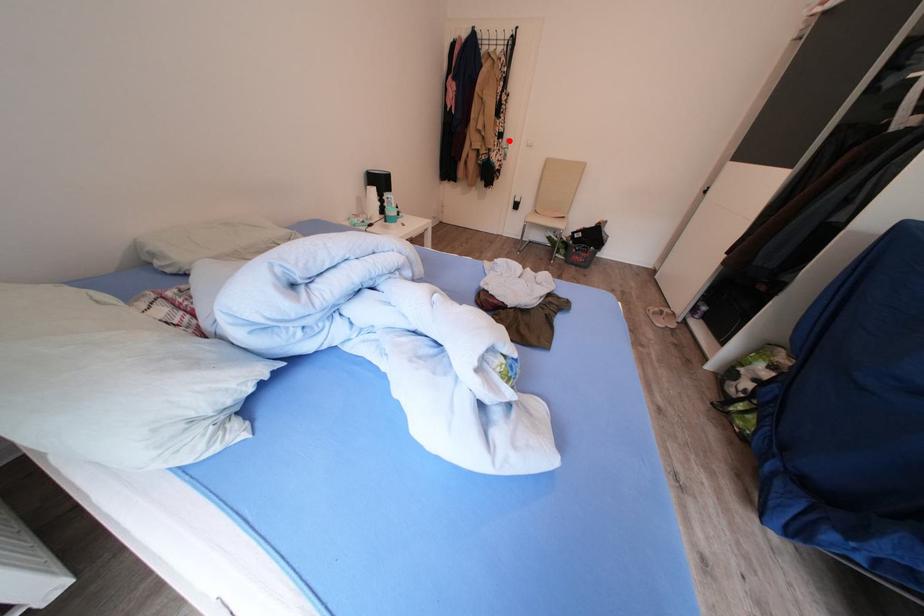
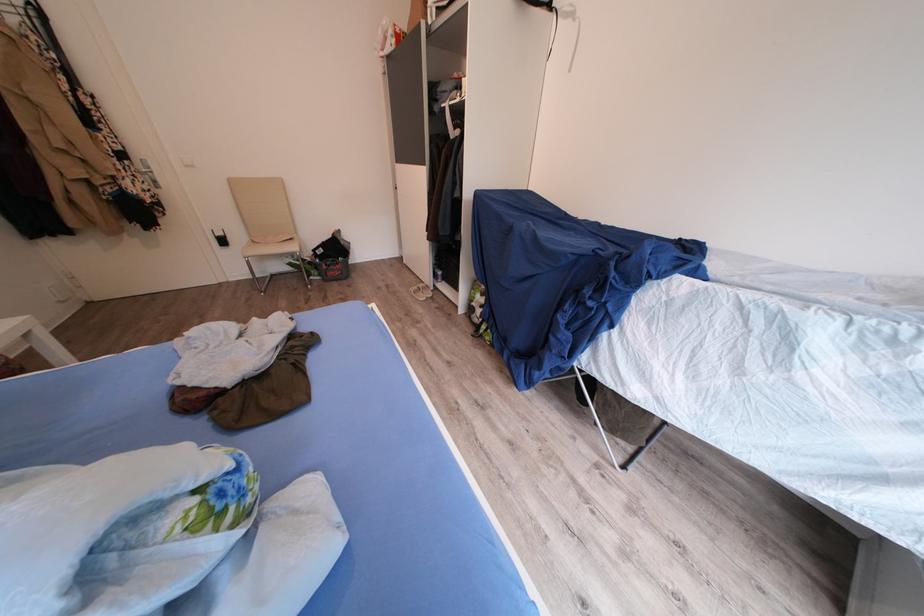
The point at the highlighted location is marked in the first image. Where is the corresponding point in the second image?

(130, 161)